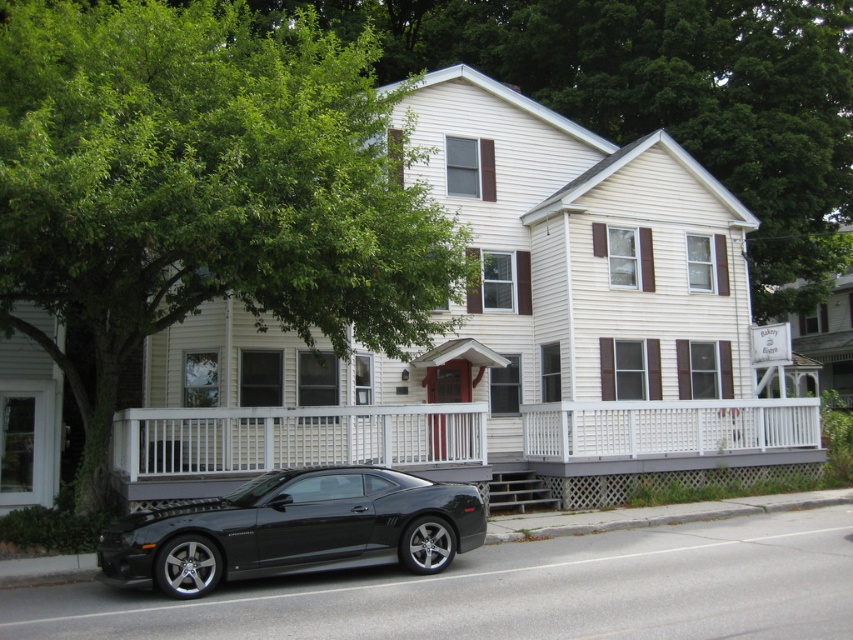
You are standing on the sidewalk in front of the house and want to take a photo of the red front door without any obstructions. Which object between the green leafy tree at upper left and the black glossy sedan at lower left is less likely to block your view?

The black glossy sedan at lower left is less likely to block your view because it is shorter than the green leafy tree at upper left, which is much taller.

You are a photographer trying to capture a wide shot of the house without any obstructions. The green leafy tree at upper left and the black glossy sedan at lower left are in the frame. Which object has a larger width and might block part of the house if positioned closer?

The green leafy tree at upper left has a larger width than the black glossy sedan at lower left, so it might block more of the house if positioned closer.